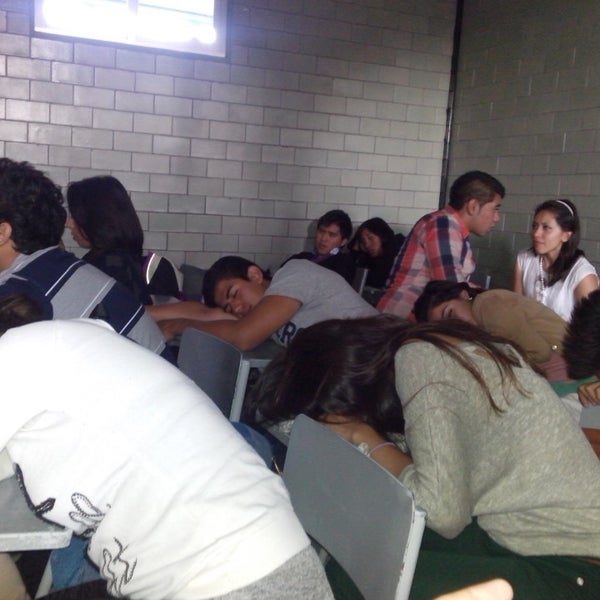
Find the location of `chair`. chair is located at coordinates (330, 472), (213, 380), (199, 274), (357, 280), (487, 276).